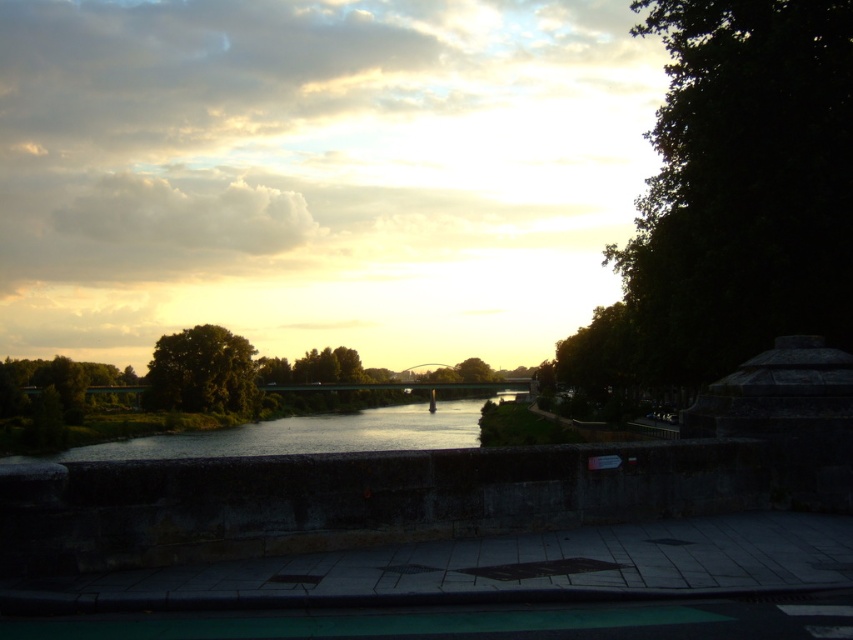
The width and height of the screenshot is (853, 640). What do you see at coordinates (730, 200) in the screenshot?
I see `dark green leafy tree at right` at bounding box center [730, 200].

Can you confirm if dark green leafy tree at right is taller than silvery reflective water at center?

Yes.

Based on the photo, who is more forward, (825, 156) or (184, 449)?

Point (825, 156) is in front.

You are a GUI agent. You are given a task and a screenshot of the screen. Output one action in this format:
    pyautogui.click(x=<x>, y=<y>)
    Task: Click on the dark green leafy tree at right
    The image size is (853, 640).
    Given the screenshot: What is the action you would take?
    pyautogui.click(x=730, y=200)

Does dark green leafy tree at right appear over green leafy tree at center?

Yes.

Does dark green leafy tree at right have a lesser width compared to green leafy tree at center?

No.

Who is more forward, (804, 177) or (239, 397)?

Point (804, 177) is in front.

Where is `dark green leafy tree at right`? dark green leafy tree at right is located at coordinates (730, 200).

Find the location of `silvery reflective water at center`. silvery reflective water at center is located at coordinates (300, 435).

Which is above, silvery reflective water at center or green leafy tree at center?

green leafy tree at center is higher up.

Does point (165, 442) come in front of point (210, 397)?

Yes.

Where is `silvery reflective water at center`? The width and height of the screenshot is (853, 640). silvery reflective water at center is located at coordinates (x=300, y=435).